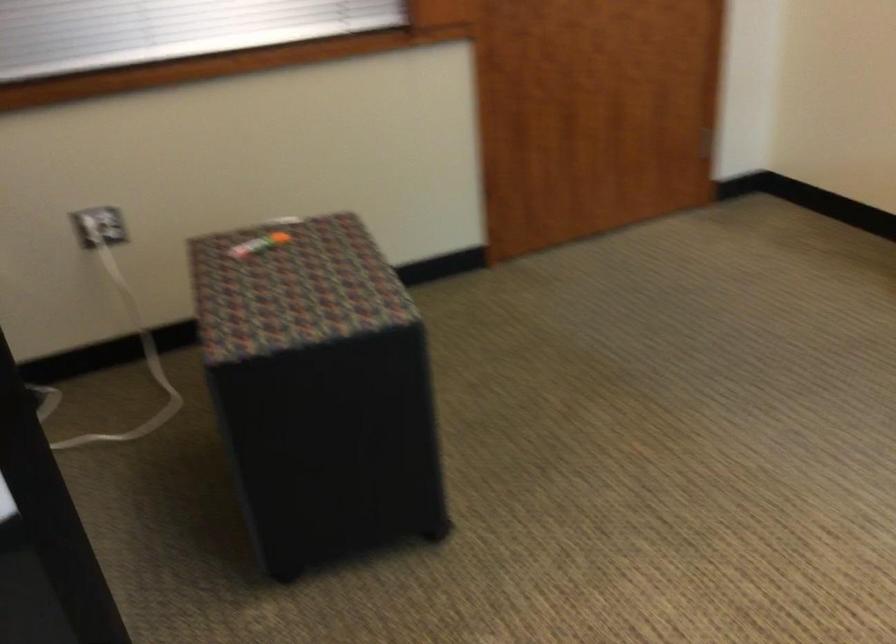
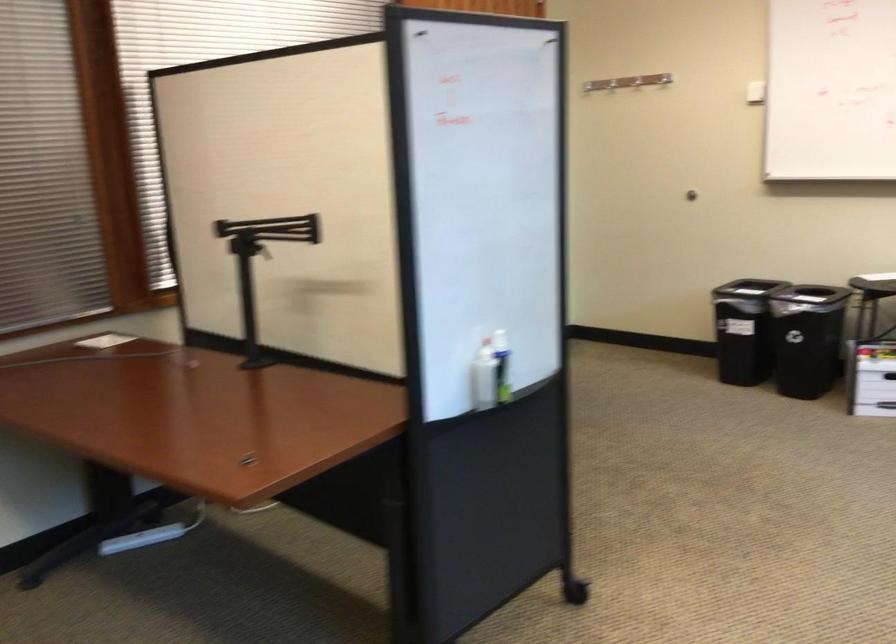
Question: I am providing you with two images of the same scene from different viewpoints. Please identify which objects are invisible in image2.

Choices:
 (A) black monitor arm
 (B) white electrical plug
 (C) metal coat hook
 (D) yellow snack box

Answer: (B)